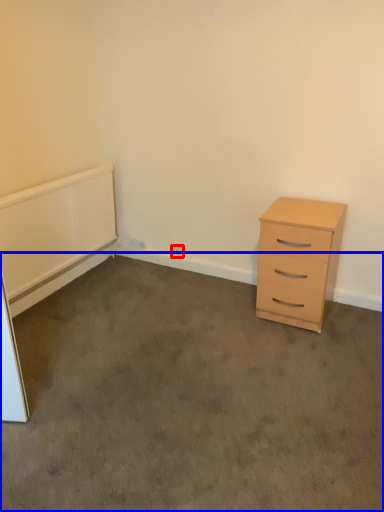
Question: Which of the following is the farthest to the observer, electric outlet (highlighted by a red box) or plain (highlighted by a blue box)?

Choices:
 (A) electric outlet
 (B) plain

Answer: (A)